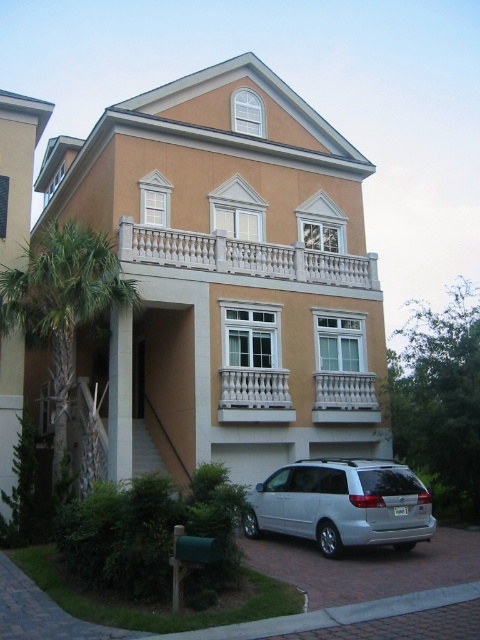
Looking at this image, you are standing in front of the residential building and want to determine the relative positions of two points marked on the facade. Which point, point (24, 301) or point (177, 253), is closer to you?

Point (24, 301) is closer to the viewer than point (177, 253).